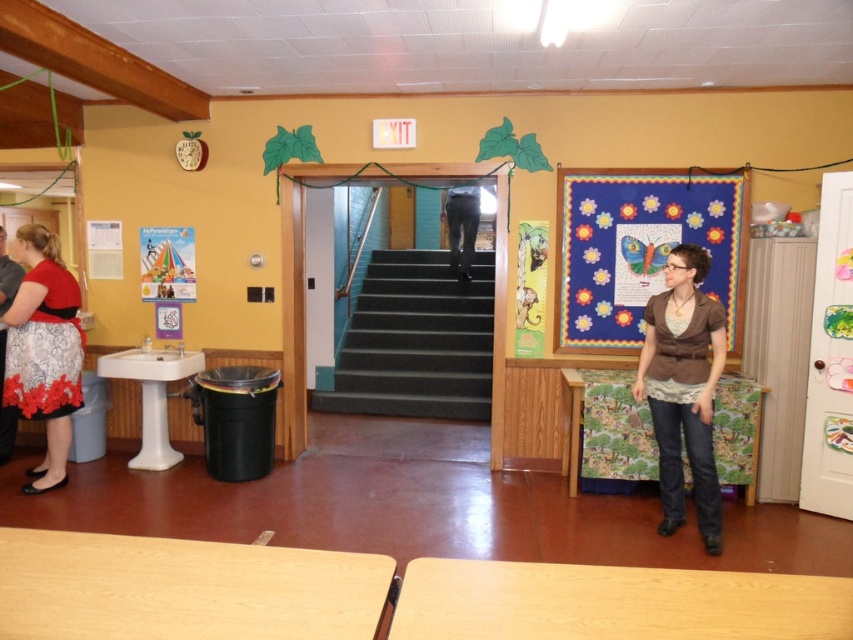
Does brown fabric shirt at center appear under floral lace skirt at lower left?

Indeed, brown fabric shirt at center is positioned under floral lace skirt at lower left.

Is brown fabric shirt at center above floral lace skirt at lower left?

No.

Where is `brown fabric shirt at center`? brown fabric shirt at center is located at coordinates (683, 388).

At what (x,y) coordinates should I click in order to perform the action: click on brown fabric shirt at center. Please return your answer as a coordinate pair (x, y). Looking at the image, I should click on (683, 388).

Can you confirm if multicolored fabric butterfly at right is positioned to the left of floral lace skirt at lower left?

No, multicolored fabric butterfly at right is not to the left of floral lace skirt at lower left.

In the scene shown: Does multicolored fabric butterfly at right have a greater height compared to floral lace skirt at lower left?

In fact, multicolored fabric butterfly at right may be shorter than floral lace skirt at lower left.

I want to click on multicolored fabric butterfly at right, so (637, 250).

Locate an element on the screen. multicolored fabric butterfly at right is located at coordinates (637, 250).

Can you confirm if brown fabric shirt at center is positioned below black jeans at center?

Correct, brown fabric shirt at center is located below black jeans at center.

Which is in front, point (704, 403) or point (445, 195)?

Point (704, 403) is more forward.

Where is `brown fabric shirt at center`? This screenshot has height=640, width=853. brown fabric shirt at center is located at coordinates (683, 388).